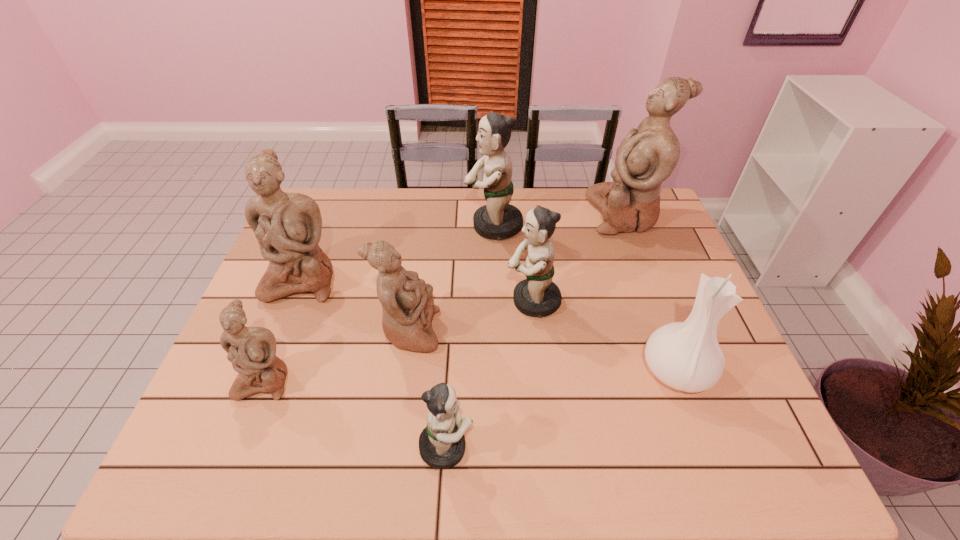
The height and width of the screenshot is (540, 960). I want to click on free space located 0.130m on the front-facing side of the second farthest green figurine, so click(458, 301).

You are a GUI agent. You are given a task and a screenshot of the screen. Output one action in this format:
    pyautogui.click(x=<x>, y=<y>)
    Task: Click on the free spot located 0.330m on the front-facing side of the second farthest green figurine
    
    Given the screenshot: What is the action you would take?
    pyautogui.click(x=385, y=301)

Where is `vacant region located on the front-facing side of the second white figurine from right to left`? The image size is (960, 540). vacant region located on the front-facing side of the second white figurine from right to left is located at coordinates point(510,331).

You are a GUI agent. You are given a task and a screenshot of the screen. Output one action in this format:
    pyautogui.click(x=<x>, y=<y>)
    Task: Click on the vacant space situated on the left of the white vase
    The image size is (960, 540).
    Given the screenshot: What is the action you would take?
    pyautogui.click(x=612, y=370)

The width and height of the screenshot is (960, 540). Find the location of `vacant space situated 0.080m on the front-facing side of the nearest white figurine`. vacant space situated 0.080m on the front-facing side of the nearest white figurine is located at coordinates (241, 437).

The image size is (960, 540). I want to click on free region located 0.380m on the front-facing side of the smallest green figurine, so click(x=656, y=447).

Where is `object that is at the near edge`? The width and height of the screenshot is (960, 540). object that is at the near edge is located at coordinates (442, 443).

This screenshot has height=540, width=960. I want to click on figurine positioned at the right edge, so click(646, 157).

Where is `vase located in the right edge section of the desktop`? vase located in the right edge section of the desktop is located at coordinates (686, 356).

Find the location of a particular element. This screenshot has width=960, height=540. object that is positioned at the far right corner is located at coordinates (646, 157).